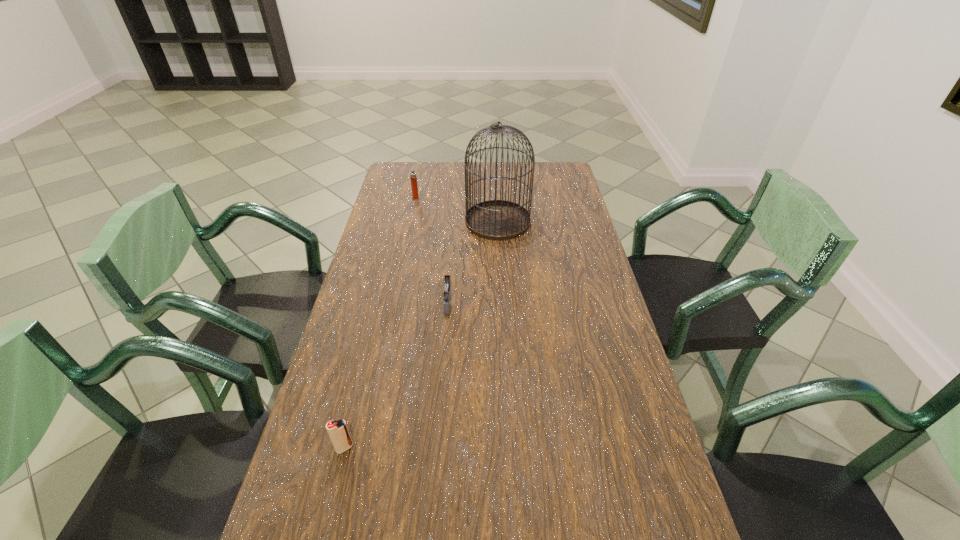
This screenshot has height=540, width=960. I want to click on the tallest object, so click(495, 219).

You are a GUI agent. You are given a task and a screenshot of the screen. Output one action in this format:
    pyautogui.click(x=<x>, y=<y>)
    Task: Click on the rightmost object
    This screenshot has width=960, height=540.
    Given the screenshot: What is the action you would take?
    pyautogui.click(x=495, y=219)

The height and width of the screenshot is (540, 960). What are the coordinates of `the farthest object` in the screenshot? It's located at (413, 177).

Identify the location of the farthest igniter. (413, 177).

Where is `the rightmost igniter`? This screenshot has height=540, width=960. the rightmost igniter is located at coordinates (446, 288).

Locate an element on the screen. the third object from left to right is located at coordinates (446, 288).

The height and width of the screenshot is (540, 960). Find the location of `the leftmost igniter`. the leftmost igniter is located at coordinates (338, 432).

Where is `the nearest igniter`? This screenshot has width=960, height=540. the nearest igniter is located at coordinates (338, 432).

Where is `vacant space positioned 0.320m on the left of the third nearest object`? vacant space positioned 0.320m on the left of the third nearest object is located at coordinates (378, 221).

Find the location of a particular element. vacant position located 0.050m on the left of the second igniter from right to left is located at coordinates (399, 197).